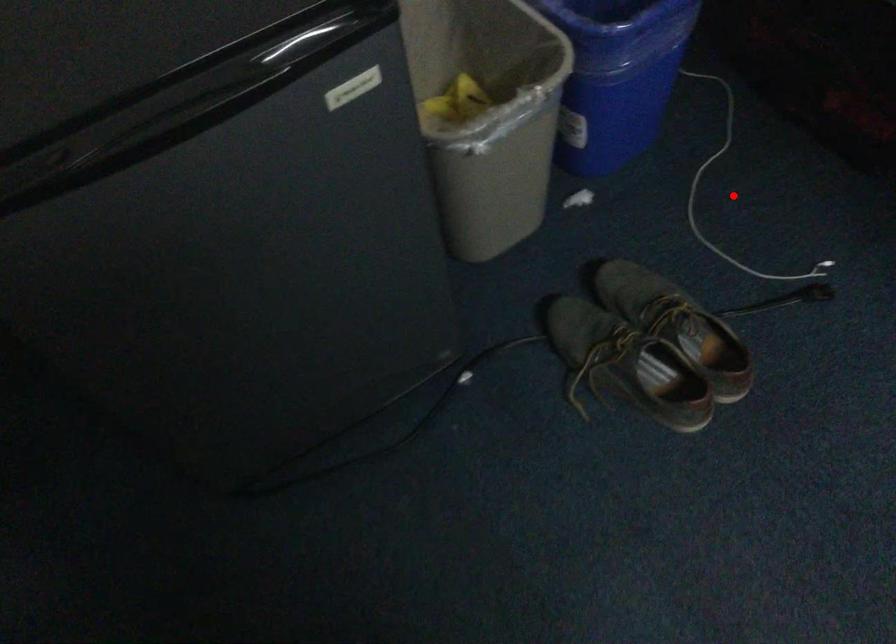
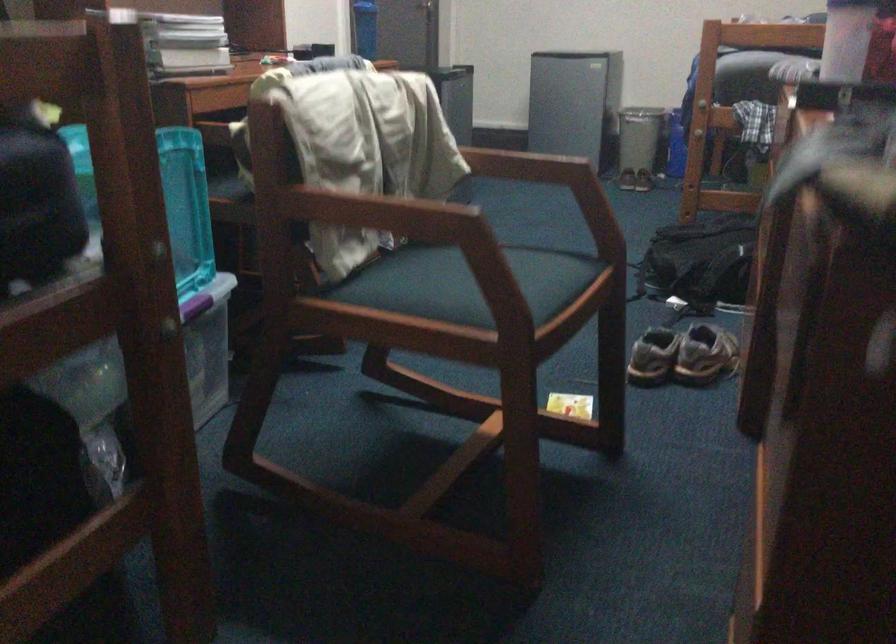
Question: I am providing you with two images of the same scene from different viewpoints. A red point is marked on the first image. Can you still see the location of the red point in image 2?

Choices:
 (A) Yes
 (B) No

Answer: (B)